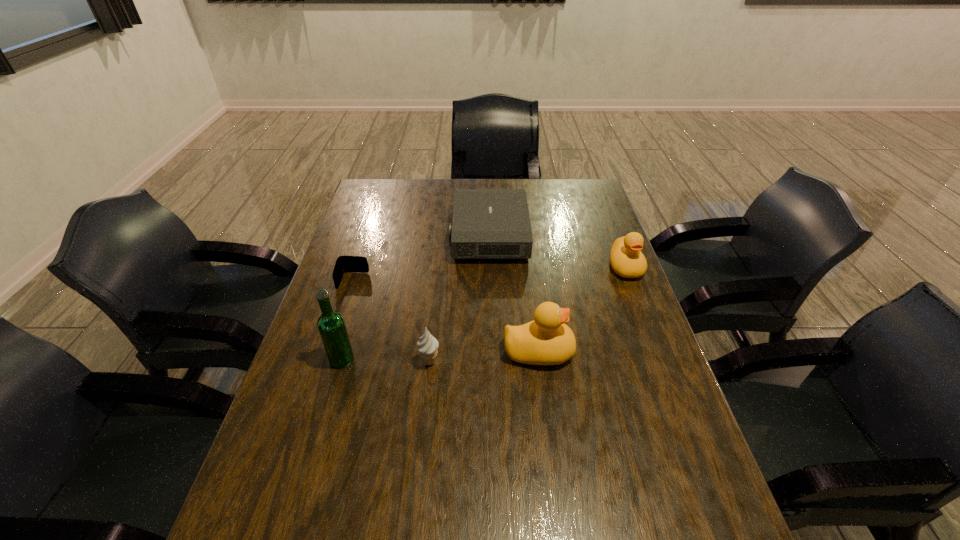
Find the location of a particular element. The width and height of the screenshot is (960, 540). free space located on the right of the tallest object is located at coordinates (508, 359).

Find the location of a particular element. The image size is (960, 540). free space located 0.210m on the front-facing side of the icecream is located at coordinates (523, 362).

Where is `free space located on the front-facing side of the projector`? The height and width of the screenshot is (540, 960). free space located on the front-facing side of the projector is located at coordinates (437, 235).

Find the location of a particular element. This screenshot has width=960, height=540. vacant space located on the front-facing side of the projector is located at coordinates (356, 235).

At what (x,y) coordinates should I click in order to perform the action: click on free space located on the front-facing side of the projector. Please return your answer as a coordinate pair (x, y). Looking at the image, I should click on (428, 235).

Find the location of a particular element. The image size is (960, 540). free space located on the outer surface of the shortest object is located at coordinates (312, 406).

Image resolution: width=960 pixels, height=540 pixels. Find the location of `object at the far edge`. object at the far edge is located at coordinates (487, 223).

In order to click on beer bottle that is at the left edge in this screenshot , I will do `click(331, 325)`.

This screenshot has width=960, height=540. What are the coordinates of `wallet at the left edge` in the screenshot? It's located at (343, 264).

At what (x,y) coordinates should I click in order to perform the action: click on object located at the right edge. Please return your answer as a coordinate pair (x, y). Looking at the image, I should click on (626, 259).